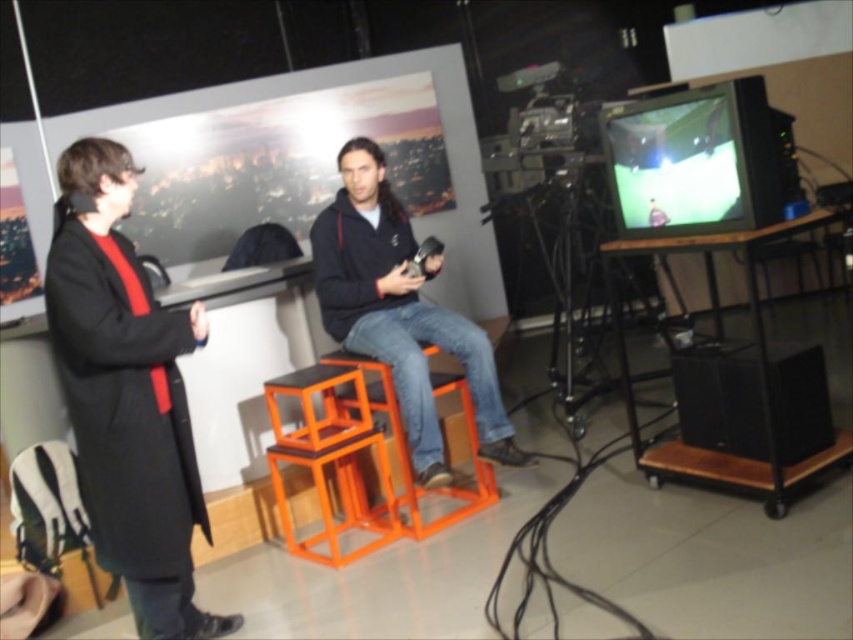
Question: Which object appears closest to the camera in this image?

Choices:
 (A) orange metallic bar stool at center
 (B) orange plastic chair at lower left
 (C) orange plastic stool at center
 (D) matte black jacket at center

Answer: (A)

Question: Which object appears closest to the camera in this image?

Choices:
 (A) orange plastic chair at lower left
 (B) orange metallic bar stool at center
 (C) matte black jacket at center

Answer: (B)

Question: From the image, what is the correct spatial relationship of matte black coat at left in relation to orange plastic chair at lower left?

Choices:
 (A) right
 (B) left

Answer: (A)

Question: Can you confirm if matte black coat at left is positioned to the right of matte black jacket at center?

Choices:
 (A) no
 (B) yes

Answer: (A)

Question: Is matte black jacket at center below orange plastic chair at lower left?

Choices:
 (A) no
 (B) yes

Answer: (A)

Question: Which of the following is the closest to the observer?

Choices:
 (A) (282, 376)
 (B) (474, 490)

Answer: (A)